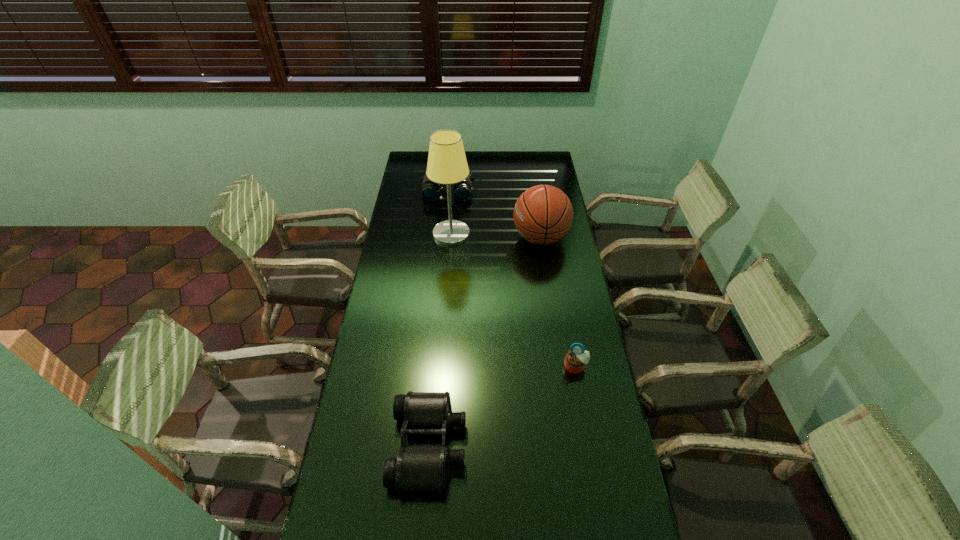
Where is `the tallest object`? This screenshot has height=540, width=960. the tallest object is located at coordinates (447, 164).

Locate an element on the screen. The height and width of the screenshot is (540, 960). basketball is located at coordinates (543, 214).

Where is `the taller binoculars`? Image resolution: width=960 pixels, height=540 pixels. the taller binoculars is located at coordinates (430, 191).

At what (x,y) coordinates should I click in order to perform the action: click on the farthest object. Please return your answer as a coordinate pair (x, y). Looking at the image, I should click on (430, 191).

At what (x,y) coordinates should I click in order to perform the action: click on muffin. Please return your answer as a coordinate pair (x, y). The width and height of the screenshot is (960, 540). Looking at the image, I should click on (575, 361).

Locate an element on the screen. the nearest object is located at coordinates (417, 467).

In order to click on the nearer binoculars in this screenshot , I will do `click(417, 467)`.

Identify the location of vacant space situated on the right of the table lamp. The height and width of the screenshot is (540, 960). (532, 234).

You are a GUI agent. You are given a task and a screenshot of the screen. Output one action in this format:
    pyautogui.click(x=<x>, y=<y>)
    Task: Click on the free space located 0.200m on the logo side of the fourth shortest object
    
    Given the screenshot: What is the action you would take?
    pyautogui.click(x=468, y=238)

At what (x,y) coordinates should I click in order to perform the action: click on free space located 0.170m on the logo side of the fourth shortest object. Please return your answer as a coordinate pair (x, y). Looking at the image, I should click on (474, 238).